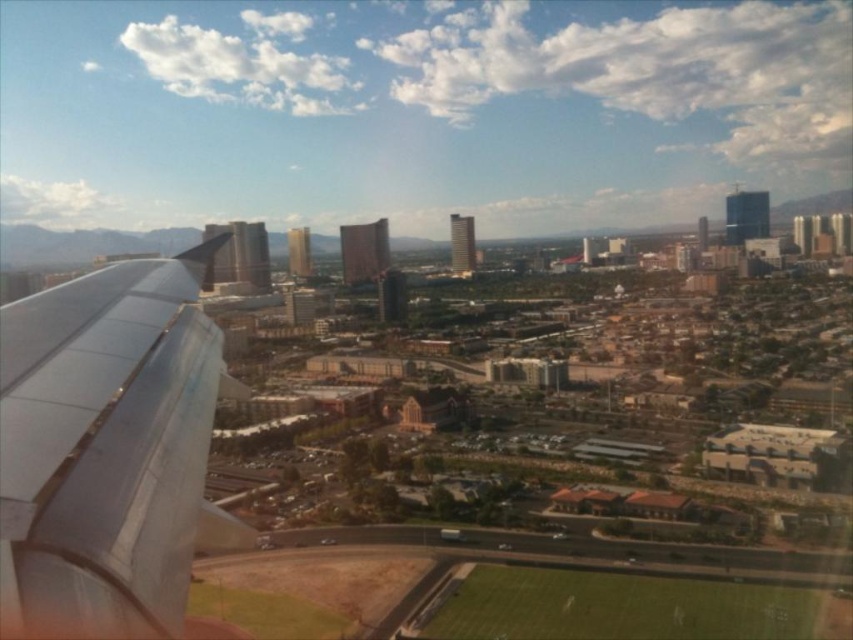
You are a passenger on an airplane and notice the metallic gray wing at left and the green grass football field at lower center through the window. Which object appears bigger from your viewpoint?

The metallic gray wing at left appears bigger because it is closer to you than the green grass football field at lower center, making it larger in your view.

You are a pilot flying at an altitude of 10,000 feet and want to determine the distance between the camera and the point labeled as point (120, 568). Can you calculate this distance using the given information?

The point labeled point (120, 568) is 973.57 feet from the camera, so the distance between the camera and the point is exactly 973.57 feet.

You are a passenger on an airplane and looking out the window. You see the metallic gray wing at left and the green grass football field at lower center. Which object is closer to you?

The metallic gray wing at left is closer to you because it is in front of the green grass football field at lower center.